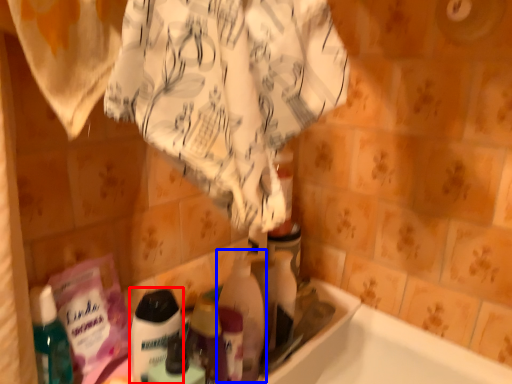
Question: Which point is further to the camera, cleaning product (highlighted by a red box) or cleaning product (highlighted by a blue box)?

Choices:
 (A) cleaning product
 (B) cleaning product

Answer: (B)